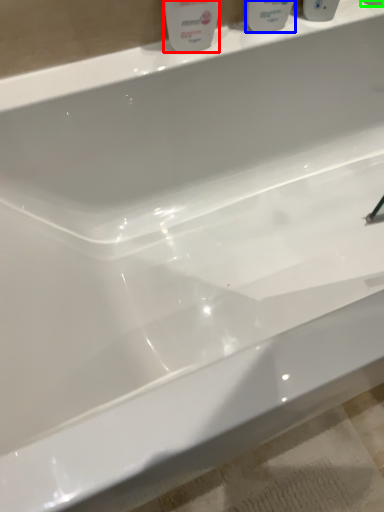
Question: Which object is the closest to the cleaning product (highlighted by a red box)? Choose among these: mouthwash (highlighted by a blue box) or mouthwash (highlighted by a green box).

Choices:
 (A) mouthwash
 (B) mouthwash

Answer: (A)